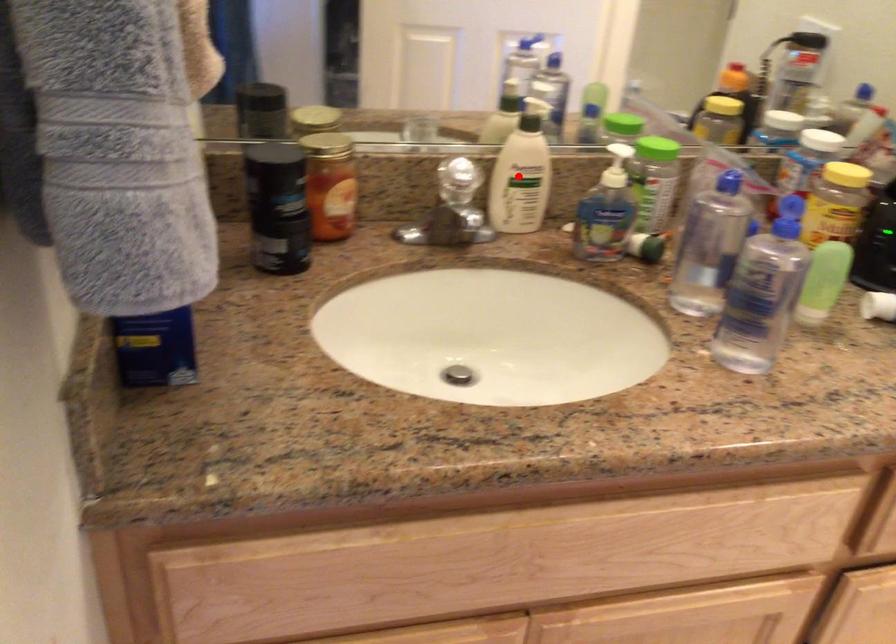
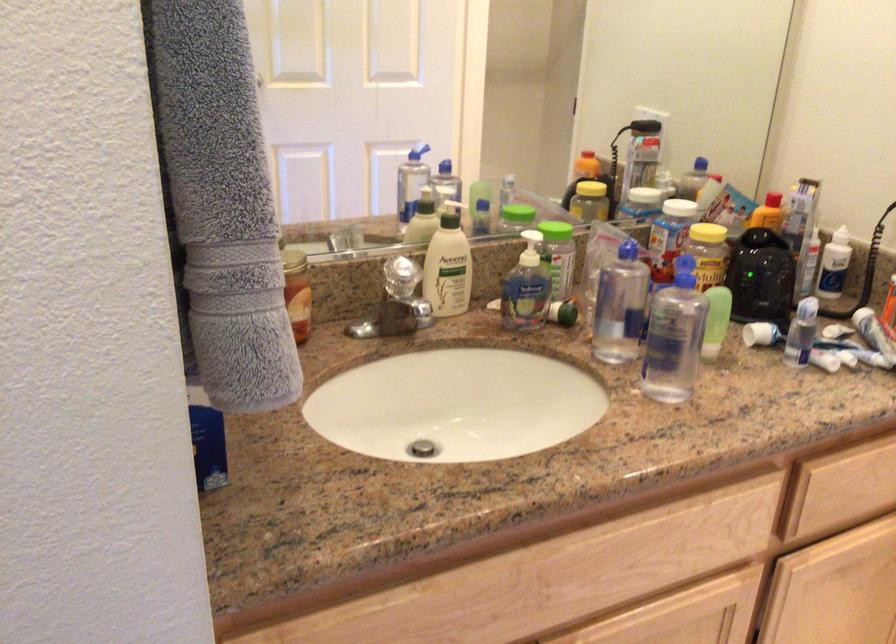
Locate, in the second image, the point that corresponds to the highlighted location in the first image.

(448, 265)